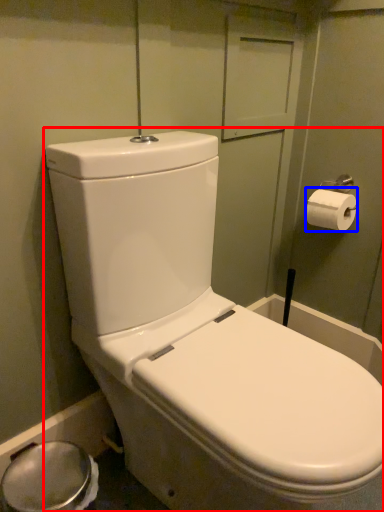
Question: Which object appears farthest to the camera in this image, toilet (highlighted by a red box) or toilet paper (highlighted by a blue box)?

Choices:
 (A) toilet
 (B) toilet paper

Answer: (B)